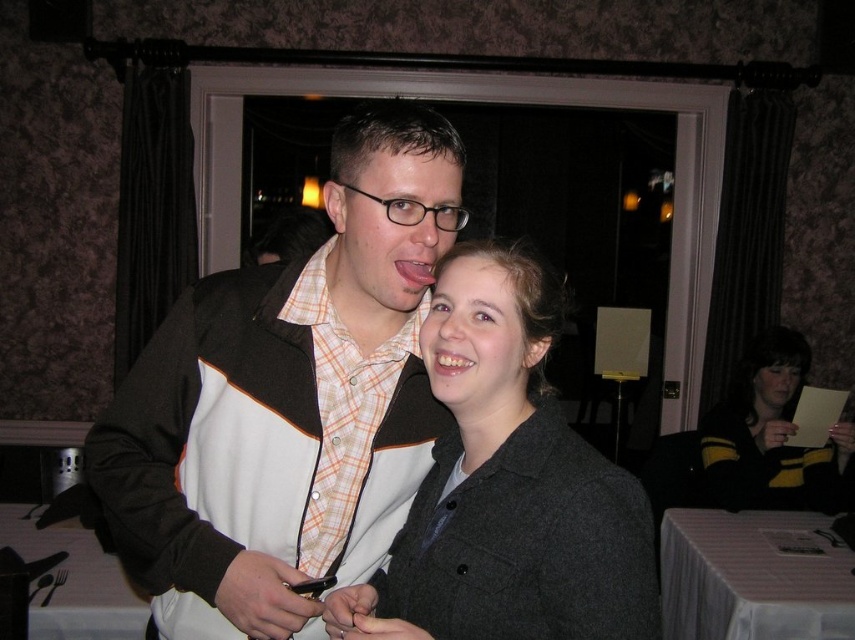
Does matte brown jacket at center lie behind matte gray coat at center?

Yes.

Is matte brown jacket at center closer to camera compared to matte gray coat at center?

No, matte brown jacket at center is further to the viewer.

Locate an element on the screen. Image resolution: width=855 pixels, height=640 pixels. matte brown jacket at center is located at coordinates (x=287, y=401).

What do you see at coordinates (506, 486) in the screenshot?
I see `matte gray coat at center` at bounding box center [506, 486].

Who is higher up, matte gray coat at center or yellow-black sweater at lower right?

matte gray coat at center

Is point (447, 576) behind point (753, 372)?

No, it is not.

This screenshot has width=855, height=640. Identify the location of matte gray coat at center. pos(506,486).

Who is more forward, (x=387, y=456) or (x=789, y=328)?

Point (x=387, y=456) is in front.

Locate an element on the screen. Image resolution: width=855 pixels, height=640 pixels. matte brown jacket at center is located at coordinates (287, 401).

What are the coordinates of `matte brown jacket at center` in the screenshot? It's located at (287, 401).